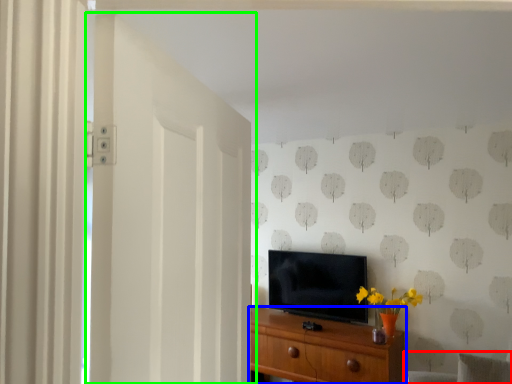
Question: Which object is the farthest from swivel chair (highlighted by a red box)? Choose among these: chest of drawers (highlighted by a blue box) or door (highlighted by a green box).

Choices:
 (A) chest of drawers
 (B) door

Answer: (B)